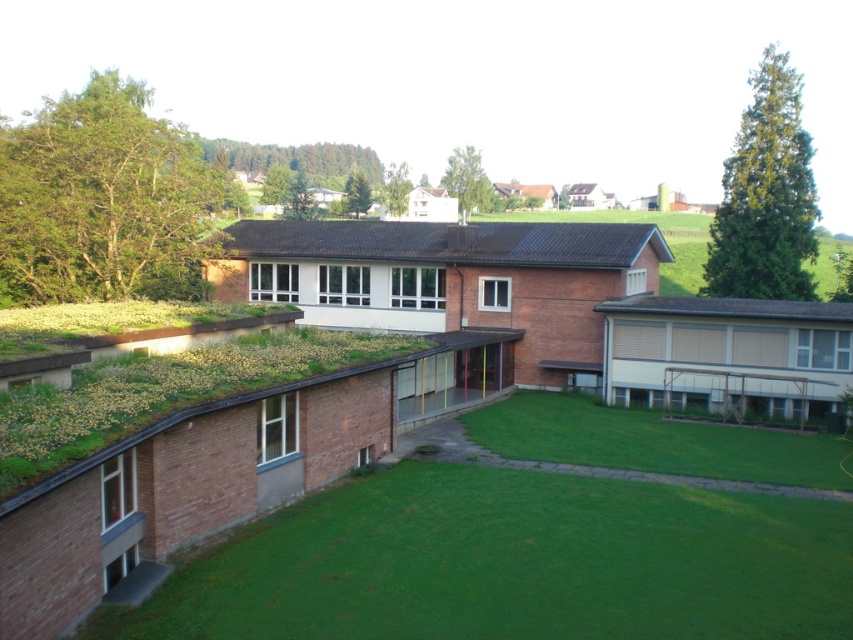
Can you confirm if green grass at lower left is positioned to the right of gray shingles at upper right?

No, green grass at lower left is not to the right of gray shingles at upper right.

Between point (508, 595) and point (612, 307), which one is positioned in front?

Positioned in front is point (508, 595).

I want to click on green grass at lower left, so click(x=509, y=564).

Locate an element on the screen. The height and width of the screenshot is (640, 853). green grass at lower left is located at coordinates (509, 564).

Does green grass at lower left have a larger size compared to black tile roof at center?

No.

Between point (666, 486) and point (288, 250), which one is positioned behind?

The point (288, 250) is more distant.

What do you see at coordinates (509, 564) in the screenshot? The height and width of the screenshot is (640, 853). I see `green grass at lower left` at bounding box center [509, 564].

Locate an element on the screen. This screenshot has height=640, width=853. green grass at lower left is located at coordinates (509, 564).

Between black tile roof at center and gray shingles at upper right, which one appears on the left side from the viewer's perspective?

black tile roof at center

Who is higher up, black tile roof at center or gray shingles at upper right?

black tile roof at center

Where is `black tile roof at center`? This screenshot has width=853, height=640. black tile roof at center is located at coordinates (450, 243).